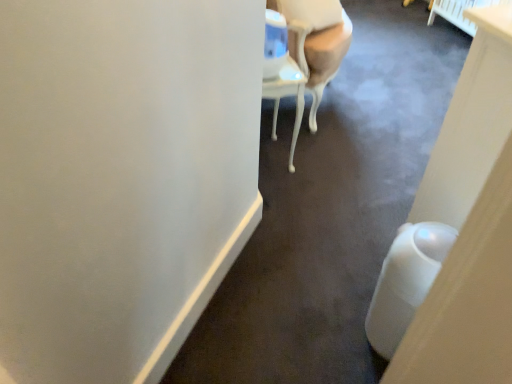
Question: Should I look upward or downward to see white glossy chair at upper center?

Choices:
 (A) down
 (B) up

Answer: (B)